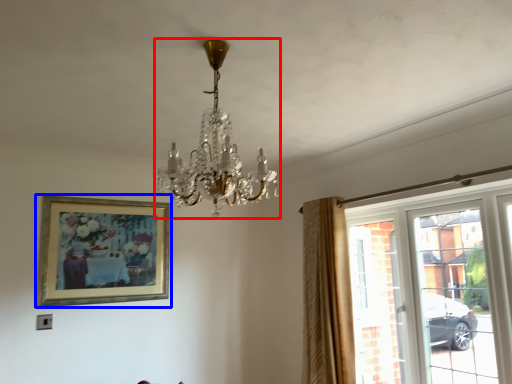
Question: Among these objects, which one is nearest to the camera, lamp (highlighted by a red box) or picture frame (highlighted by a blue box)?

Choices:
 (A) lamp
 (B) picture frame

Answer: (A)